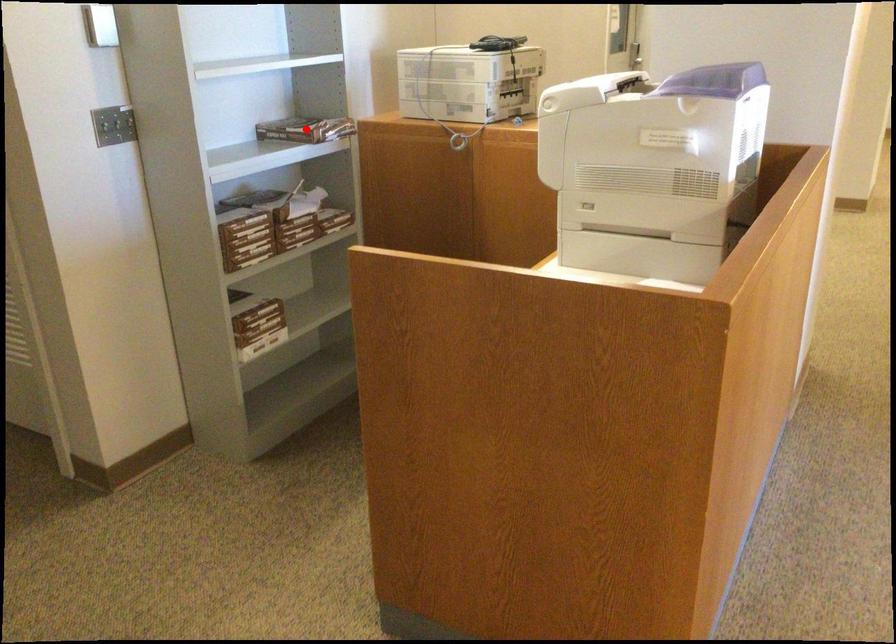
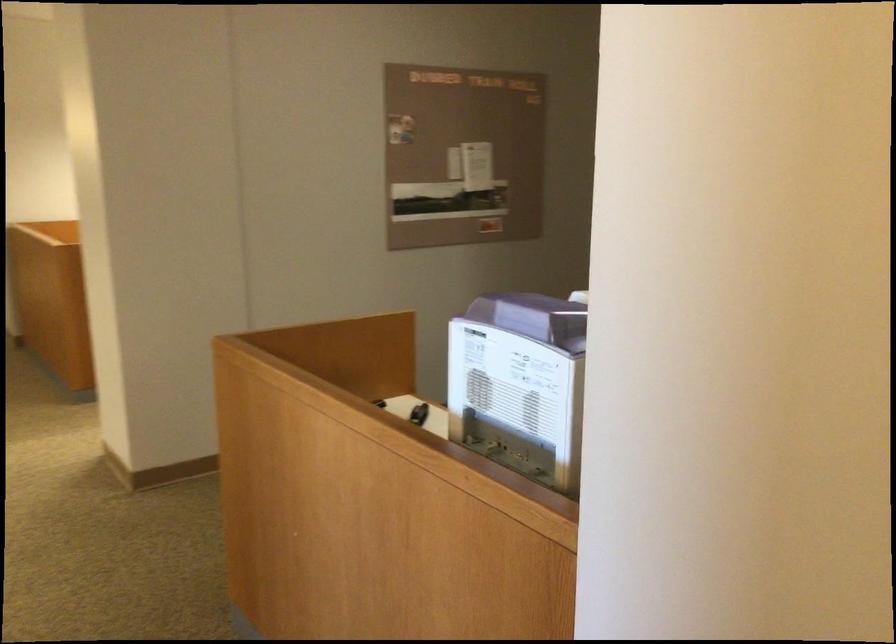
Question: I am providing you with two images of the same scene from different viewpoints. A red point is marked on the first image. Is the red point's position out of view in image 2?

Choices:
 (A) Yes
 (B) No

Answer: (A)